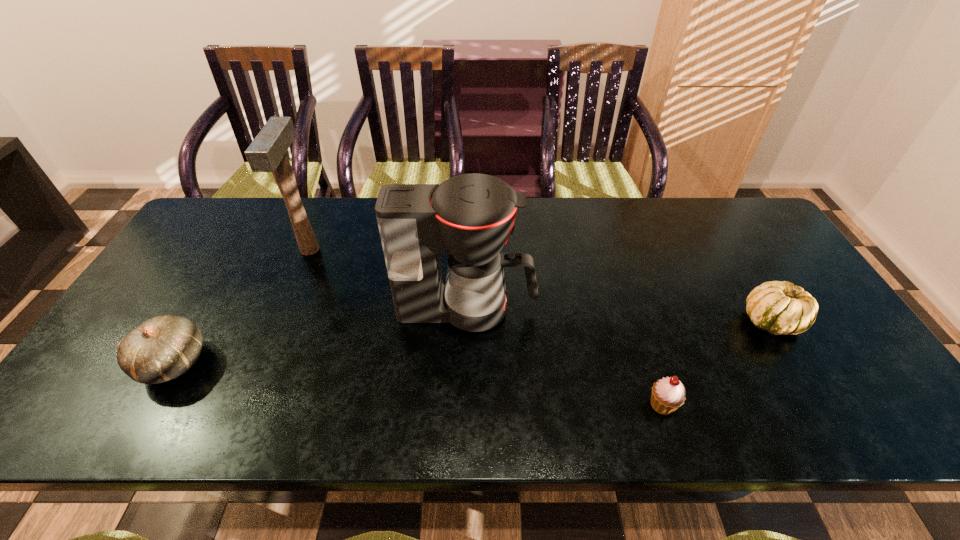
Locate an element on the screen. This screenshot has width=960, height=540. free region located on the left of the rightmost object is located at coordinates (724, 321).

The height and width of the screenshot is (540, 960). In order to click on vacant area situated 0.400m on the right of the shortest object in this screenshot , I will do `click(858, 404)`.

Locate an element on the screen. The image size is (960, 540). object present at the far edge is located at coordinates (267, 153).

At what (x,y) coordinates should I click in order to perform the action: click on object at the near edge. Please return your answer as a coordinate pair (x, y). Image resolution: width=960 pixels, height=540 pixels. Looking at the image, I should click on (668, 394).

In order to click on object that is at the left edge in this screenshot , I will do `click(162, 348)`.

The height and width of the screenshot is (540, 960). I want to click on object at the right edge, so [780, 308].

The width and height of the screenshot is (960, 540). Identify the location of vacant space at the far edge. (532, 227).

The image size is (960, 540). Identify the location of free space at the near edge. (253, 422).

Identify the location of vacant space at the left edge of the desktop. Image resolution: width=960 pixels, height=540 pixels. (221, 249).

This screenshot has width=960, height=540. In the image, there is a desktop. In order to click on vacant space at the right edge in this screenshot , I will do `click(808, 377)`.